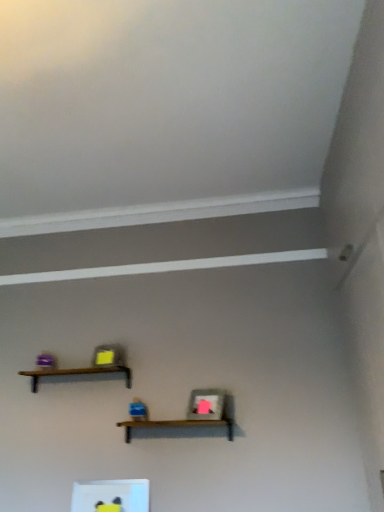
Question: Is white glossy frame at lower center, which ranks as the third shelf in top-to-bottom order, positioned far away from brown wooden shelf at upper center, which is the 1th shelf in top-to-bottom order?

Choices:
 (A) no
 (B) yes

Answer: (A)

Question: Does white glossy frame at lower center, which ranks as the third shelf in top-to-bottom order, have a greater height compared to brown wooden shelf at upper center, the third shelf in the bottom-to-top sequence?

Choices:
 (A) yes
 (B) no

Answer: (A)

Question: Is the depth of white glossy frame at lower center, which is the 1th shelf from bottom to top, less than that of brown wooden shelf at upper center, which is the 1th shelf in top-to-bottom order?

Choices:
 (A) yes
 (B) no

Answer: (A)

Question: From a real-world perspective, is white glossy frame at lower center, which is the 1th shelf from bottom to top, located higher than brown wooden shelf at upper center, which is the 1th shelf in top-to-bottom order?

Choices:
 (A) no
 (B) yes

Answer: (A)

Question: Is white glossy frame at lower center, which is the 1th shelf from bottom to top, touching brown wooden shelf at upper center, which is the 1th shelf in top-to-bottom order?

Choices:
 (A) no
 (B) yes

Answer: (A)

Question: From the image's perspective, is white glossy frame at lower center, which ranks as the third shelf in top-to-bottom order, located above or below brown wooden shelf at upper center, which is the 1th shelf in top-to-bottom order?

Choices:
 (A) below
 (B) above

Answer: (A)

Question: In terms of size, does white glossy frame at lower center, which is the 1th shelf from bottom to top, appear bigger or smaller than brown wooden shelf at upper center, which is the 1th shelf in top-to-bottom order?

Choices:
 (A) small
 (B) big

Answer: (A)

Question: Is point (92, 483) closer or farther from the camera than point (130, 374)?

Choices:
 (A) farther
 (B) closer

Answer: (B)

Question: From their relative heights in the image, would you say white glossy frame at lower center, which ranks as the third shelf in top-to-bottom order, is taller or shorter than brown wooden shelf at upper center, the third shelf in the bottom-to-top sequence?

Choices:
 (A) tall
 (B) short

Answer: (A)

Question: Considering the positions of point (66, 373) and point (221, 422), is point (66, 373) closer or farther from the camera than point (221, 422)?

Choices:
 (A) closer
 (B) farther

Answer: (B)

Question: Visually, is brown wooden shelf at upper center, the third shelf in the bottom-to-top sequence, positioned to the left or to the right of brown wooden shelf at center, the 2th shelf in the bottom-to-top sequence?

Choices:
 (A) right
 (B) left

Answer: (B)

Question: Is brown wooden shelf at upper center, the third shelf in the bottom-to-top sequence, bigger or smaller than brown wooden shelf at center, which appears as the 2th shelf when viewed from the top?

Choices:
 (A) big
 (B) small

Answer: (B)

Question: Which is correct: brown wooden shelf at upper center, the third shelf in the bottom-to-top sequence, is inside brown wooden shelf at center, which appears as the 2th shelf when viewed from the top, or outside of it?

Choices:
 (A) inside
 (B) outside

Answer: (B)

Question: Which is correct: brown wooden shelf at center, which appears as the 2th shelf when viewed from the top, is inside brown wooden shelf at upper center, the third shelf in the bottom-to-top sequence, or outside of it?

Choices:
 (A) inside
 (B) outside

Answer: (B)

Question: Is brown wooden shelf at center, the 2th shelf in the bottom-to-top sequence, to the left or to the right of brown wooden shelf at upper center, which is the 1th shelf in top-to-bottom order, in the image?

Choices:
 (A) left
 (B) right

Answer: (B)